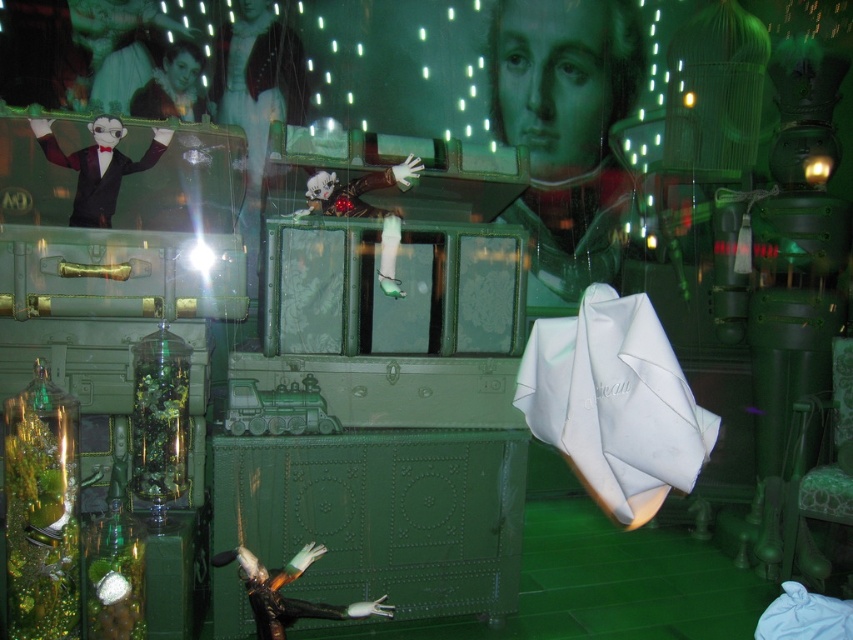
You are a security guard in a museum and notice a suspicious object at point (97, 164). Which object from the scene is located at that coordinate?

The matte black suit at upper left is located at point (97, 164).

In the surreal green scene, there is a white satin umbrella at center right and a shiny silver figurine at center. From the perspective of someone standing in front of the scene, which object is positioned to the left?

The shiny silver figurine at center is positioned to the left of the white satin umbrella at center right.

Based on the photo, you are an interior designer assessing the layout of this surreal exhibit. You notice the matte black suit at upper left and the shiny silver figurine at center. Which object occupies more horizontal space in the scene?

The shiny silver figurine at center has a greater width than the matte black suit at upper left, so it occupies more horizontal space in the scene.